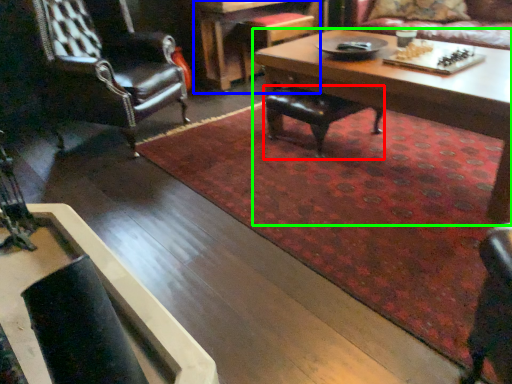
Question: Based on their relative distances, which object is nearer to chair (highlighted by a red box)? Choose from table (highlighted by a blue box) and coffee table (highlighted by a green box).

Choices:
 (A) table
 (B) coffee table

Answer: (B)